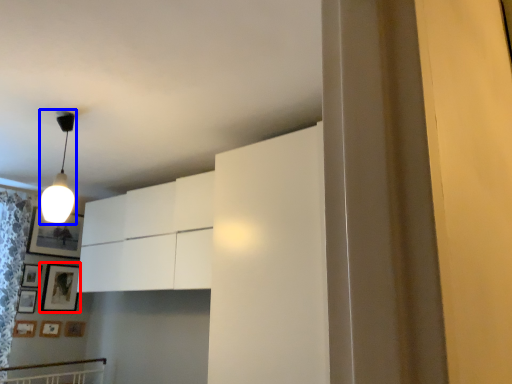
Question: Which point is further to the camera, picture frame (highlighted by a red box) or lamp (highlighted by a blue box)?

Choices:
 (A) picture frame
 (B) lamp

Answer: (A)